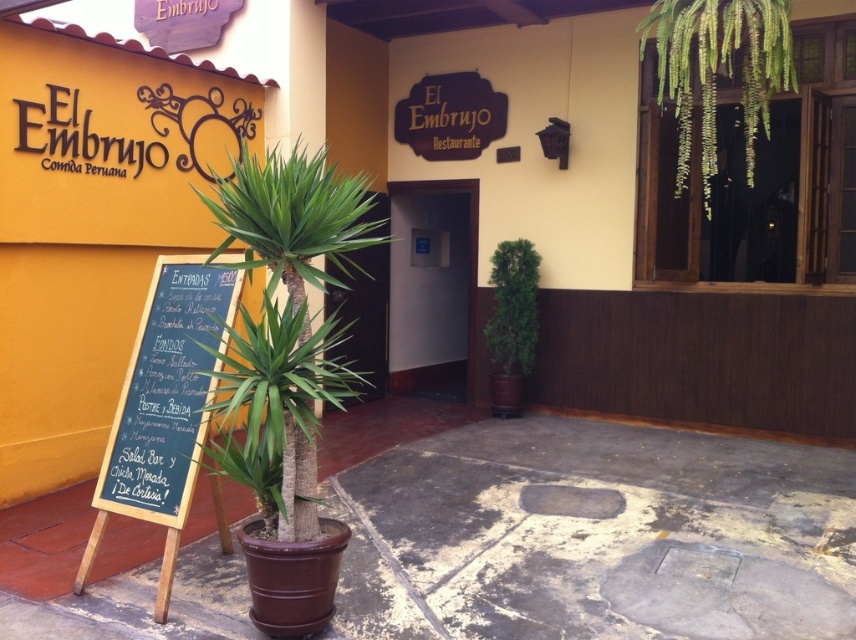
Does green leafy palm tree at center have a greater width compared to white glossy door at center?

In fact, green leafy palm tree at center might be narrower than white glossy door at center.

Who is lower down, green leafy palm tree at center or white glossy door at center?

green leafy palm tree at center

Describe the element at coordinates (290, 305) in the screenshot. The image size is (856, 640). I see `green leafy palm tree at center` at that location.

Identify the location of green leafy palm tree at center. (290, 305).

Is black chalkboard at left wider than white glossy door at center?

No.

Which of these two, black chalkboard at left or white glossy door at center, stands taller?

Standing taller between the two is white glossy door at center.

This screenshot has width=856, height=640. In order to click on black chalkboard at left in this screenshot , I will do `click(167, 392)`.

Where is `black chalkboard at left`? The image size is (856, 640). black chalkboard at left is located at coordinates [167, 392].

Does black chalkboard at left have a lesser height compared to green leafy plant at center?

Correct, black chalkboard at left is not as tall as green leafy plant at center.

Is black chalkboard at left below green leafy plant at center?

Indeed, black chalkboard at left is positioned under green leafy plant at center.

Which is behind, point (120, 467) or point (514, 253)?

Positioned behind is point (514, 253).

Find the location of a particular element. black chalkboard at left is located at coordinates (167, 392).